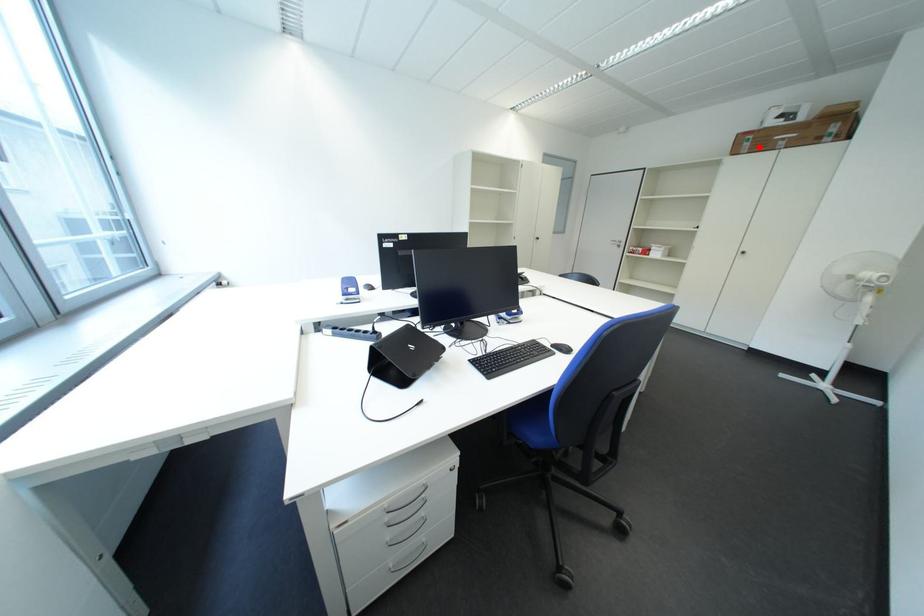
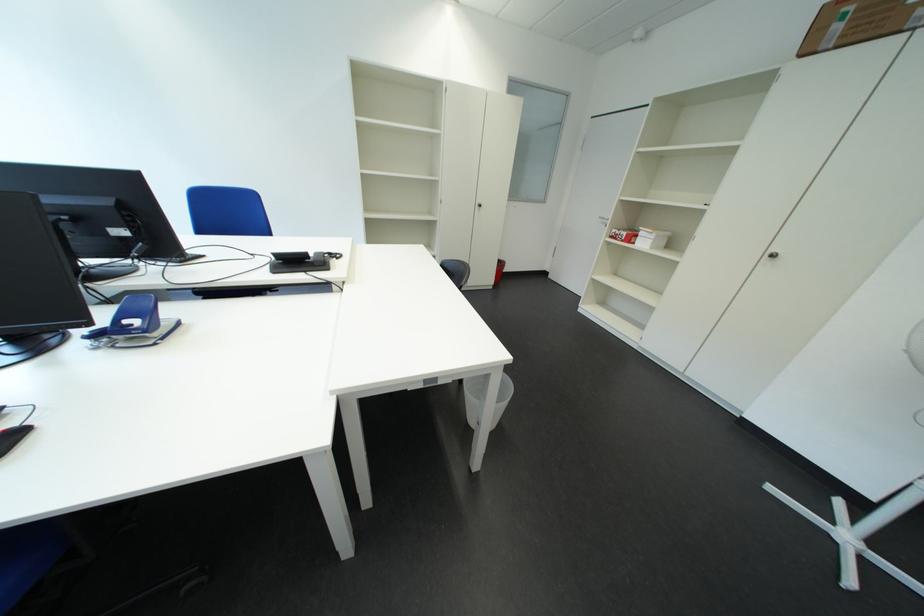
Question: I am providing you with two images of the same scene from different viewpoints. Given a red point in image1, look at the same physical point in image2. Is it:

Choices:
 (A) Closer to the viewpoint
 (B) Farther from the viewpoint

Answer: (B)